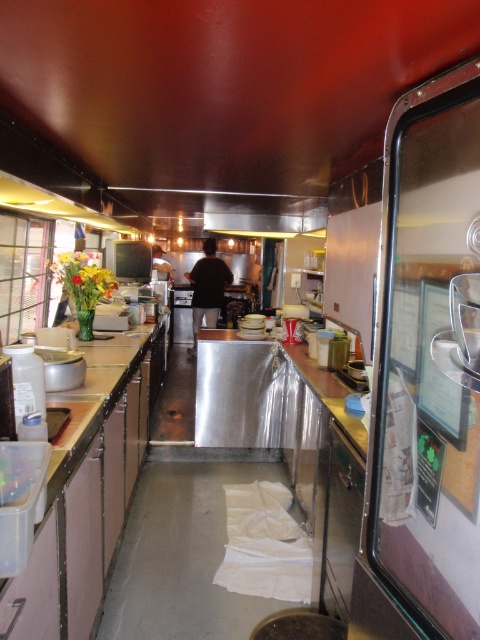
Which is more to the left, brown laminate counter at left or dark brown fabric at center?

From the viewer's perspective, brown laminate counter at left appears more on the left side.

Where is `brown laminate counter at left`? The height and width of the screenshot is (640, 480). brown laminate counter at left is located at coordinates (86, 508).

Between point (402, 193) and point (169, 269), which one is positioned in front?

Point (402, 193) is more forward.

Is point (478, 161) positioned in front of point (160, 248)?

Yes, point (478, 161) is closer to viewer.

You are a GUI agent. You are given a task and a screenshot of the screen. Output one action in this format:
    pyautogui.click(x=<x>, y=<y>)
    Task: Click on the metallic stainless steel door at center
    The height and width of the screenshot is (640, 480).
    Given the screenshot: What is the action you would take?
    pyautogui.click(x=425, y=376)

Can you confirm if silver metallic counter at center is shorter than dark brown fabric at center?

Indeed, silver metallic counter at center has a lesser height compared to dark brown fabric at center.

Can you confirm if silver metallic counter at center is positioned above dark brown fabric at center?

No, silver metallic counter at center is not above dark brown fabric at center.

Consider the image. Who is more distant from viewer, (288, 396) or (196, 317)?

The point (196, 317) is behind.

Find the location of a particular element. The image size is (480, 640). silver metallic counter at center is located at coordinates (261, 392).